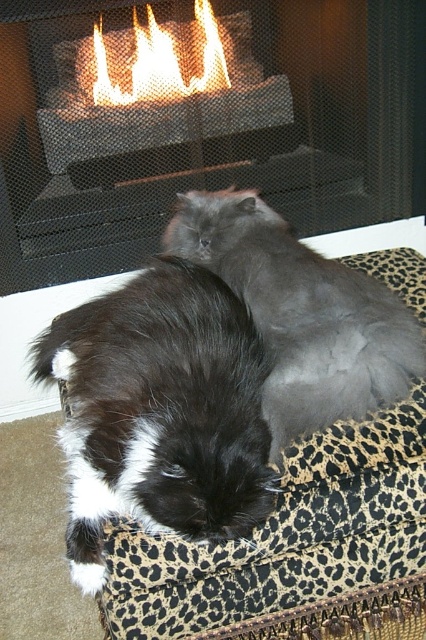
Consider the image. You are a cat owner who wants to place a new toy between the leopard print cushion at center and the gray fluffy cat at center. Based on their positions, which object should the toy be placed in front of?

The leopard print cushion at center is in front of the gray fluffy cat at center, so the toy should be placed in front of the leopard print cushion at center to ensure it is between both objects.

You are standing in the room and want to place a decorative item on the metallic mesh fireplace at center. Can you confirm the exact coordinates where the fireplace is located?

The metallic mesh fireplace at center is located at point (203, 124).

You are a cat owner who wants to place a new cat toy between the metallic mesh fireplace at center and the leopard print cushion at center. Since the fireplace is larger, where should you place the toy so it is closer to the smaller object?

The leopard print cushion at center is smaller than the metallic mesh fireplace at center. Therefore, placing the cat toy closer to the leopard print cushion at center would ensure it is nearer to the smaller object.